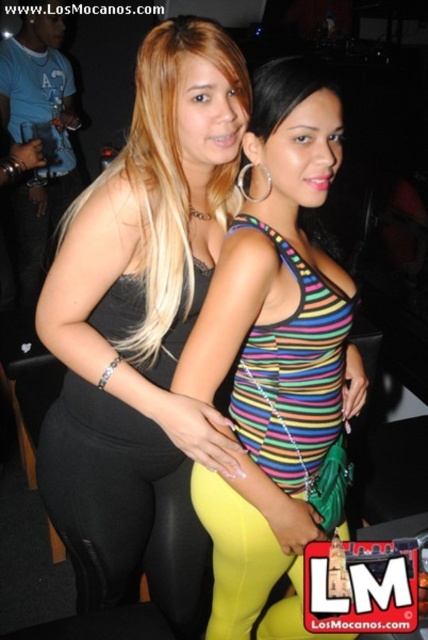
Question: Which point is closer to the camera taking this photo?

Choices:
 (A) (178, 492)
 (B) (115, 260)
 (C) (231, 353)
 (D) (252, 536)

Answer: (C)

Question: Is matte black tank top at center below black leggings at center?

Choices:
 (A) no
 (B) yes

Answer: (A)

Question: Estimate the real-world distances between objects in this image. Which object is farther from the yellow spandex leggings at lower center?

Choices:
 (A) matte black tank top at center
 (B) black leggings at center

Answer: (B)

Question: Does black leggings at center appear over yellow spandex leggings at lower center?

Choices:
 (A) yes
 (B) no

Answer: (B)

Question: Which object is the closest to the yellow spandex leggings at lower center?

Choices:
 (A) black leggings at center
 (B) matte black tank top at center
 (C) black matte tank top at center

Answer: (B)

Question: Is black matte tank top at center above yellow spandex leggings at lower center?

Choices:
 (A) yes
 (B) no

Answer: (A)